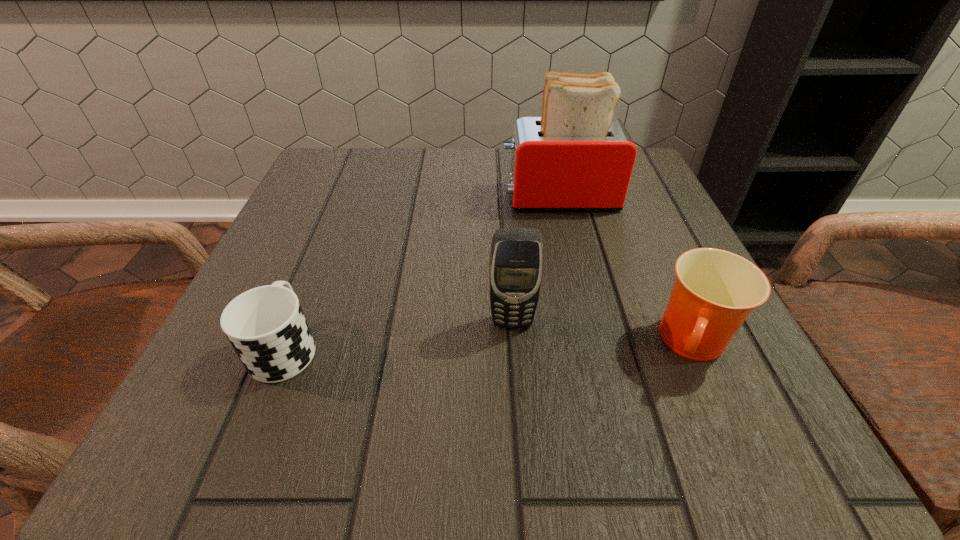
This screenshot has height=540, width=960. What are the coordinates of `free space at the far edge` in the screenshot? It's located at (468, 186).

Identify the location of vacant space at the near edge. The width and height of the screenshot is (960, 540). (436, 409).

Identify the location of free region at the left edge of the desktop. (311, 316).

The height and width of the screenshot is (540, 960). Identify the location of vacant space at the far left corner of the desktop. (351, 159).

Where is `blank area at the far right corner`? blank area at the far right corner is located at coordinates (642, 191).

In the image, there is a desktop. Identify the location of vacant space at the near right corner. Image resolution: width=960 pixels, height=540 pixels. (669, 431).

Identify the location of empty space that is in between the cellular telephone and the shortest object. This screenshot has width=960, height=540. (398, 334).

Find the location of a particular element. vacant space in between the toaster and the third tallest object is located at coordinates (627, 271).

Where is `free space between the shorter cup and the cellular telephone`? free space between the shorter cup and the cellular telephone is located at coordinates (398, 334).

Where is `free space between the left cup and the third shortest object`? The image size is (960, 540). free space between the left cup and the third shortest object is located at coordinates (398, 334).